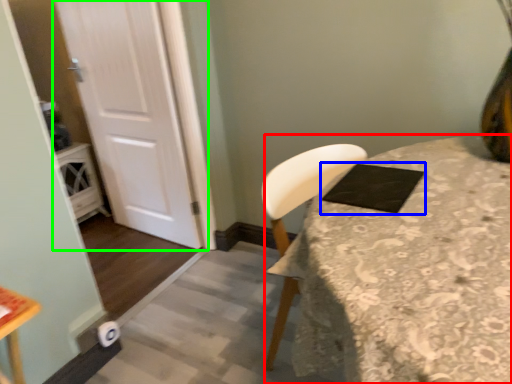
Question: Considering the real-world distances, which object is closest to table (highlighted by a red box)? pad (highlighted by a blue box) or door (highlighted by a green box).

Choices:
 (A) pad
 (B) door

Answer: (A)